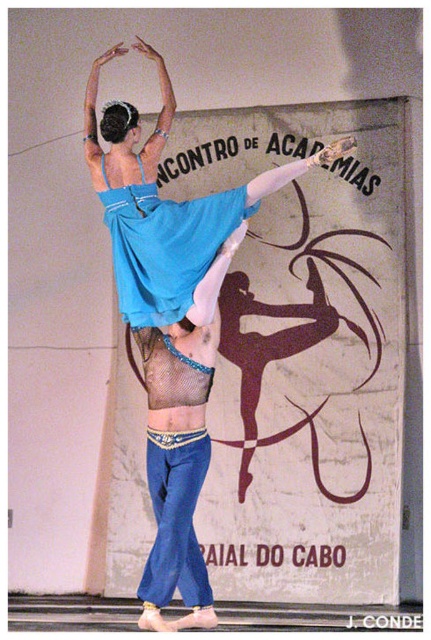
Who is taller, matte blue fabric dress at center or matte blue fabric at center?

With more height is matte blue fabric dress at center.

Can you confirm if matte blue fabric dress at center is positioned to the left of matte blue fabric at center?

Incorrect, matte blue fabric dress at center is not on the left side of matte blue fabric at center.

Describe the element at coordinates (165, 204) in the screenshot. Image resolution: width=431 pixels, height=640 pixels. I see `matte blue fabric dress at center` at that location.

Find the location of a particular element. matte blue fabric dress at center is located at coordinates (165, 204).